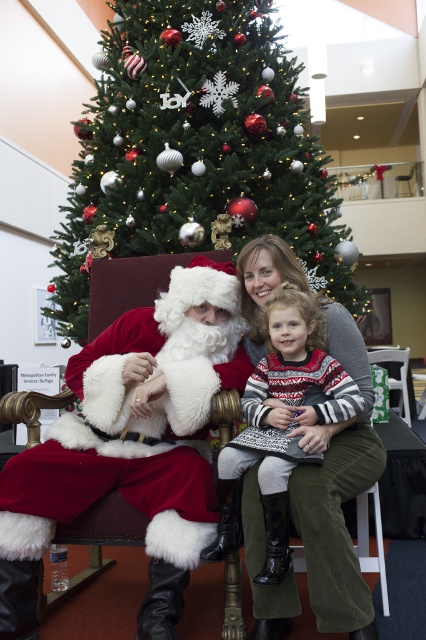
You are standing at point (267, 332) and want to move to point (302, 163). Is the path directly behind you blocked by the Christmas tree?

Point (302, 163) is behind point (267, 332), so the path directly behind you is blocked by the Christmas tree at the center.

You are a photographer trying to capture a clear shot of both the fuzzy white santa at center and the knitted sweater at center. Since you can only focus on one subject at a time, which one should you focus on to ensure the other is still somewhat in focus?

You should focus on the fuzzy white santa at center because the knitted sweater at center is behind him, so keeping Santa in focus will allow the sweater to be in the background and still somewhat in focus.